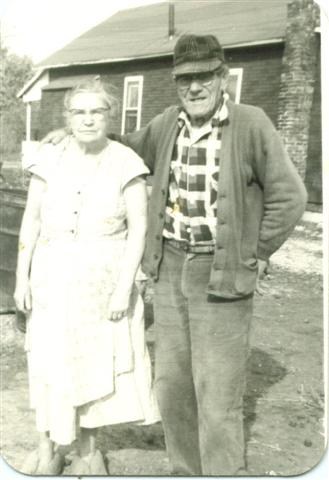
At what (x,y) coordinates should I click in order to perform the action: click on chimney. Please return your answer as a coordinate pair (x, y). Looking at the image, I should click on (302, 16), (292, 136), (172, 14).